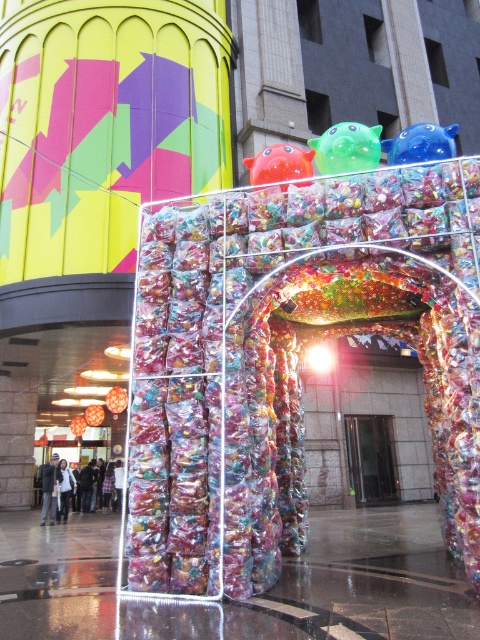
Can you confirm if green rubber toy at center is smaller than blue glossy toy at upper right?

Correct, green rubber toy at center occupies less space than blue glossy toy at upper right.

Locate an element on the screen. The width and height of the screenshot is (480, 640). green rubber toy at center is located at coordinates (347, 147).

Who is more forward, (369, 144) or (411, 157)?

Positioned in front is point (411, 157).

Identify the location of green rubber toy at center. (347, 147).

Does blue glossy toy at upper right have a larger size compared to glossy plastic ball at upper center?

Indeed, blue glossy toy at upper right has a larger size compared to glossy plastic ball at upper center.

Can you confirm if blue glossy toy at upper right is positioned to the right of glossy plastic ball at upper center?

Yes, blue glossy toy at upper right is to the right of glossy plastic ball at upper center.

Is point (415, 161) in front of point (301, 168)?

Yes, it is.

I want to click on blue glossy toy at upper right, so click(x=420, y=144).

Between point (334, 147) and point (275, 177), which one is positioned in front?

Point (334, 147)

Which is in front, point (348, 140) or point (278, 154)?

Point (348, 140) is in front.

This screenshot has height=640, width=480. Identify the location of green rubber toy at center. (347, 147).